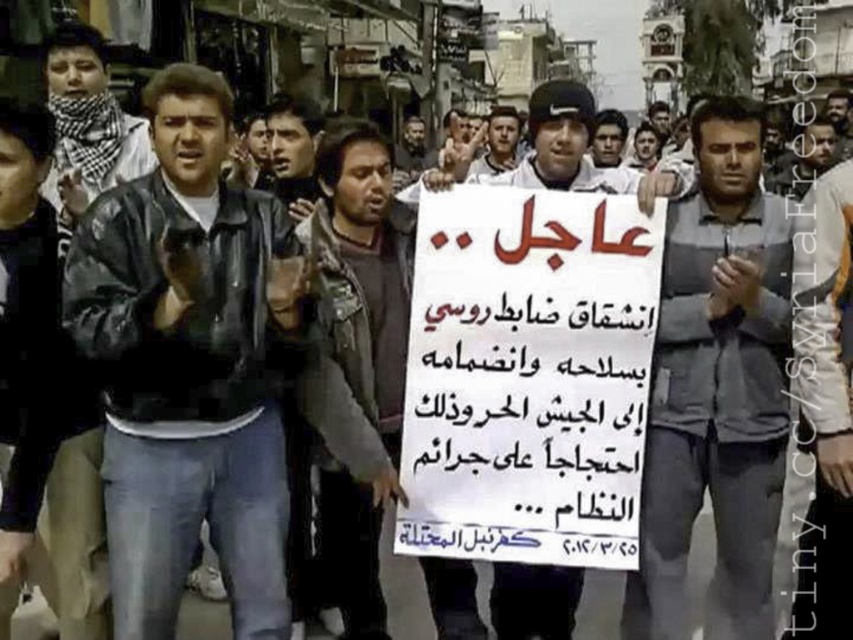
Does white paper sign at center have a greater width compared to dark gray shirt at center?

No.

Is white paper sign at center positioned behind dark gray shirt at center?

No, it is not.

Image resolution: width=853 pixels, height=640 pixels. What are the coordinates of `white paper sign at center` in the screenshot? It's located at (527, 376).

Is black leather jacket at center taller than gray fabric shirt at center?

In fact, black leather jacket at center may be shorter than gray fabric shirt at center.

Is black leather jacket at center smaller than gray fabric shirt at center?

Actually, black leather jacket at center might be larger than gray fabric shirt at center.

Where is `black leather jacket at center`? The width and height of the screenshot is (853, 640). black leather jacket at center is located at coordinates (189, 365).

Does white paper sign at center appear under gray fabric shirt at center?

Yes, white paper sign at center is below gray fabric shirt at center.

Is the position of white paper sign at center more distant than that of gray fabric shirt at center?

No, white paper sign at center is in front of gray fabric shirt at center.

Image resolution: width=853 pixels, height=640 pixels. What do you see at coordinates (527, 376) in the screenshot?
I see `white paper sign at center` at bounding box center [527, 376].

Find the location of a particular element. The height and width of the screenshot is (640, 853). white paper sign at center is located at coordinates (527, 376).